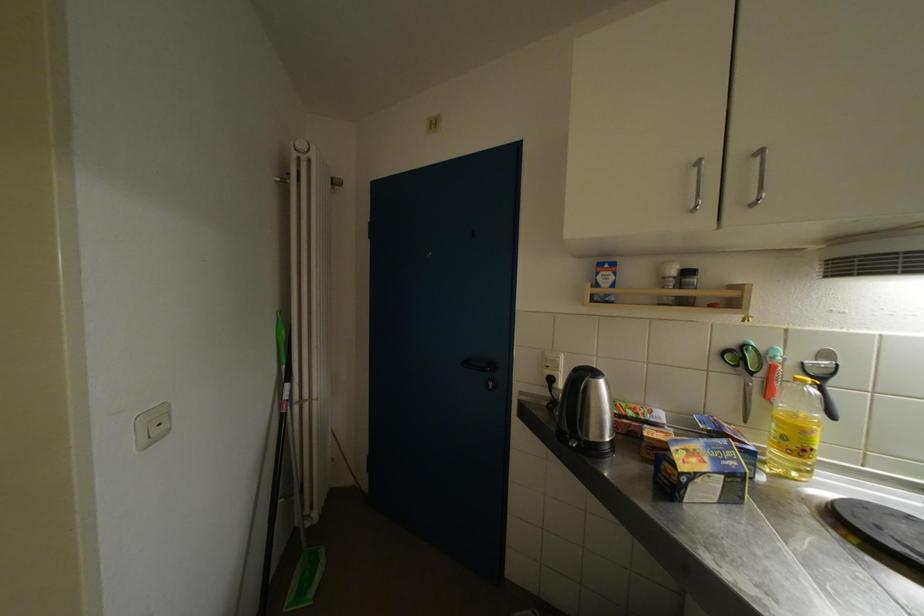
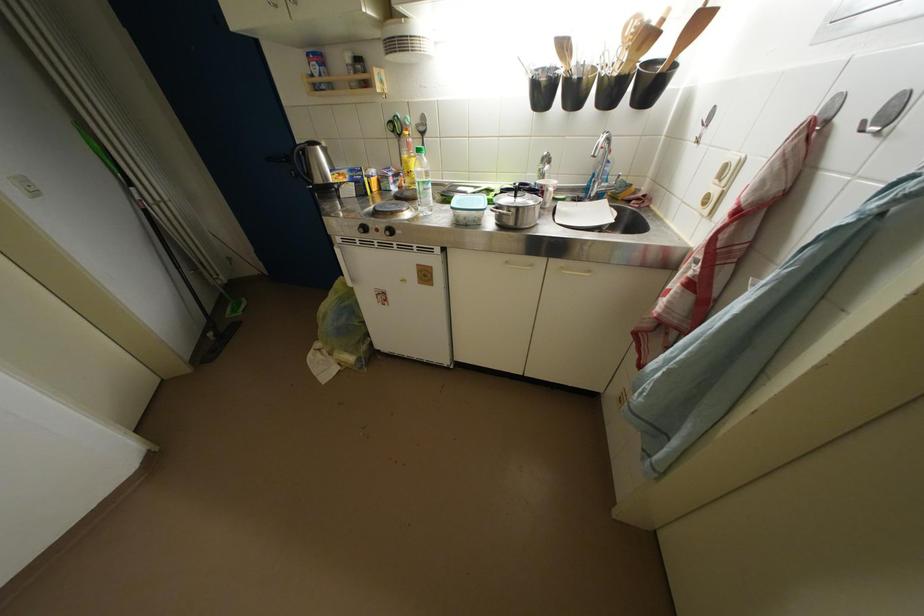
Where in the second image is the point corresponding to (609,385) from the first image?

(324, 152)